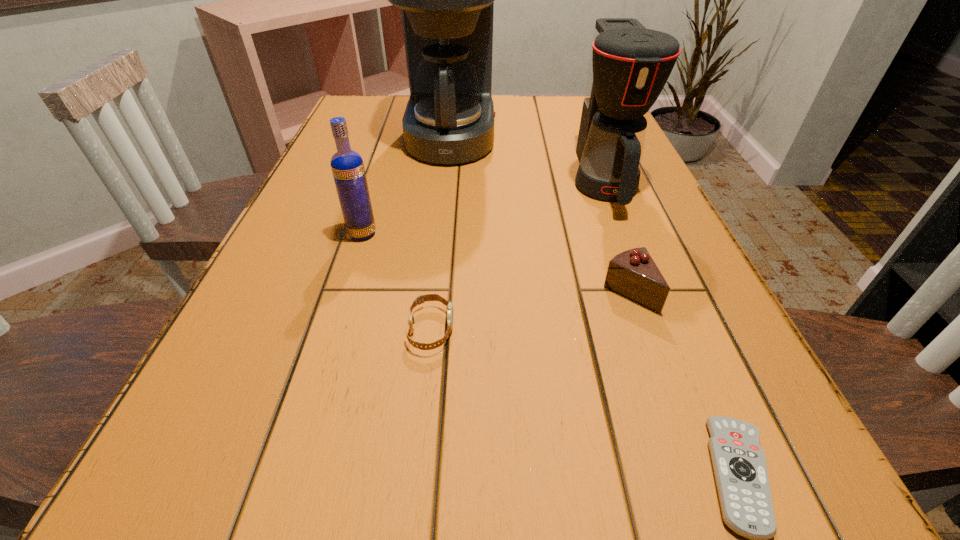
Where is `the tallest object`? the tallest object is located at coordinates (447, 0).

At what (x,y) coordinates should I click in order to perform the action: click on the taller coffee maker. Please return your answer as a coordinate pair (x, y). The height and width of the screenshot is (540, 960). Looking at the image, I should click on (447, 0).

Find the location of a particular element. the second tallest object is located at coordinates (629, 66).

You are a GUI agent. You are given a task and a screenshot of the screen. Output one action in this format:
    pyautogui.click(x=<x>, y=<y>)
    Task: Click on the shorter coffee maker
    
    Given the screenshot: What is the action you would take?
    [629, 66]

Identify the location of vodka. (347, 166).

Find the location of a particular element. the leftmost object is located at coordinates (347, 166).

This screenshot has width=960, height=540. I want to click on chocolate cake, so click(633, 273).

You are a GUI agent. You are given a task and a screenshot of the screen. Output one action in this format:
    pyautogui.click(x=<x>, y=<y>)
    Task: Click on the second shortest object
    This screenshot has height=540, width=960.
    Given the screenshot: What is the action you would take?
    (422, 298)

The image size is (960, 540). Find the location of `free space located on the button side of the taller coffee maker`. free space located on the button side of the taller coffee maker is located at coordinates (538, 139).

Find the location of `vacant point located 0.360m pour from the carafe of the second tallest object`. vacant point located 0.360m pour from the carafe of the second tallest object is located at coordinates pyautogui.click(x=678, y=368).